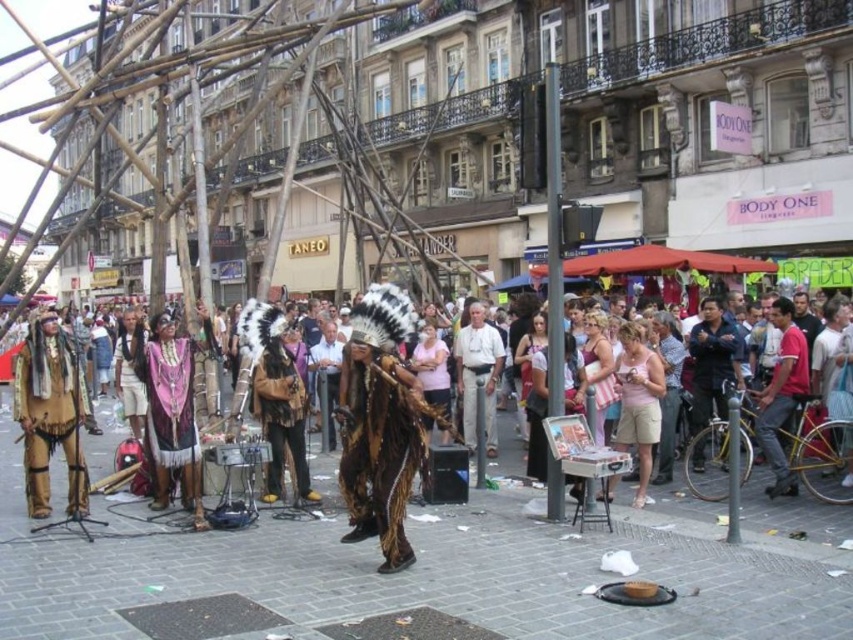
Between red shirt at center and leather fringe headdress at center, which one appears on the right side from the viewer's perspective?

From the viewer's perspective, red shirt at center appears more on the right side.

Between point (767, 452) and point (125, 328), which one is positioned in front?

Point (767, 452)

What do you see at coordinates (782, 394) in the screenshot? The height and width of the screenshot is (640, 853). I see `red shirt at center` at bounding box center [782, 394].

Identify the location of red shirt at center. (782, 394).

Between brown leather headdress at center and fur-like headdress at center, which one appears on the left side from the viewer's perspective?

brown leather headdress at center is more to the left.

Who is positioned more to the right, brown leather headdress at center or fur-like headdress at center?

fur-like headdress at center

Is point (65, 404) farther from viewer compared to point (286, 404)?

No, (65, 404) is in front of (286, 404).

In order to click on brown leather headdress at center in this screenshot , I will do `click(50, 413)`.

Can you confirm if brown furry headdress at center is positioned below red shirt at center?

Correct, brown furry headdress at center is located below red shirt at center.

Can you confirm if brown furry headdress at center is shorter than red shirt at center?

Yes.

Does point (408, 444) come farther from viewer compared to point (799, 397)?

No, it is in front of (799, 397).

You are a GUI agent. You are given a task and a screenshot of the screen. Output one action in this format:
    pyautogui.click(x=<x>, y=<y>)
    Task: Click on the brown furry headdress at center
    The image size is (853, 640).
    Given the screenshot: What is the action you would take?
    pyautogui.click(x=379, y=448)